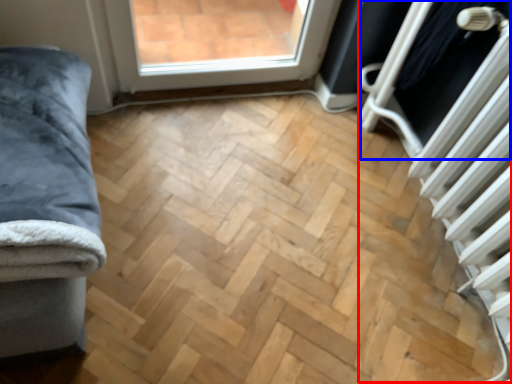
Question: Which point is further to the camera, radiator (highlighted by a red box) or screen door (highlighted by a blue box)?

Choices:
 (A) radiator
 (B) screen door

Answer: (B)